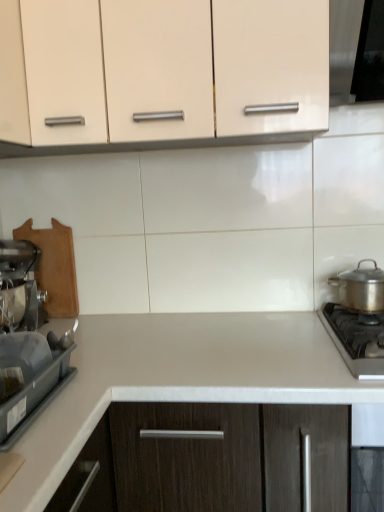
The height and width of the screenshot is (512, 384). What are the coordinates of `free location above white laminate countertop at center (from a real-world perspective)` in the screenshot? It's located at (240, 338).